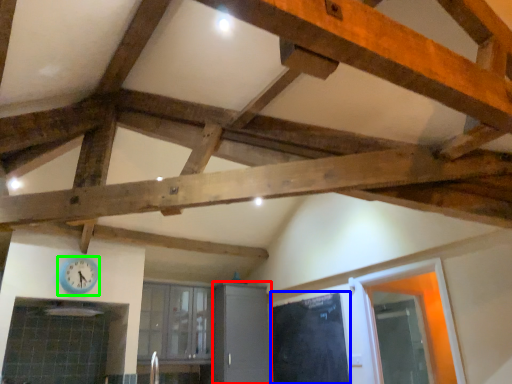
Question: Estimate the real-world distances between objects in this image. Which object is closer to cabinetry (highlighted by a red box), door (highlighted by a blue box) or clock (highlighted by a green box)?

Choices:
 (A) door
 (B) clock

Answer: (A)